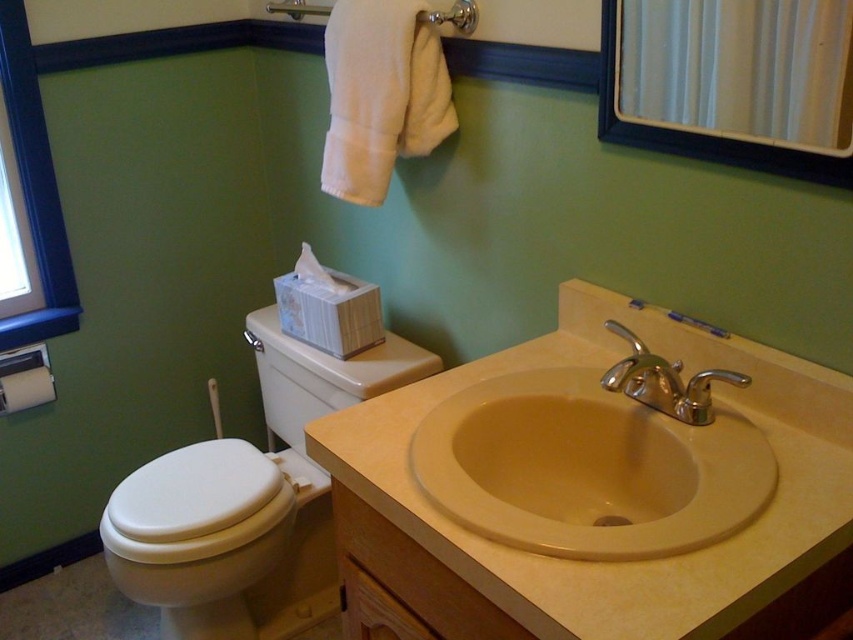
Question: Observing the image, what is the correct spatial positioning of white glossy toilet bowl at left in reference to metallic silver mirror at upper right?

Choices:
 (A) left
 (B) right

Answer: (A)

Question: Is beige laminate sink at center positioned behind metallic silver mirror at upper right?

Choices:
 (A) yes
 (B) no

Answer: (B)

Question: Which of the following is the farthest from the observer?

Choices:
 (A) beige ceramic sink at center
 (B) polished chrome faucet at sink center
 (C) beige laminate sink at center
 (D) matte white towel bar at left

Answer: (D)

Question: Among these points, which one is nearest to the camera?

Choices:
 (A) (843, 84)
 (B) (608, 374)
 (C) (573, 470)

Answer: (A)

Question: Which object is the farthest from the metallic silver mirror at upper right?

Choices:
 (A) white glossy toilet bowl at left
 (B) beige ceramic sink at center

Answer: (A)

Question: Is the position of beige laminate sink at center less distant than that of polished chrome faucet at sink center?

Choices:
 (A) yes
 (B) no

Answer: (A)